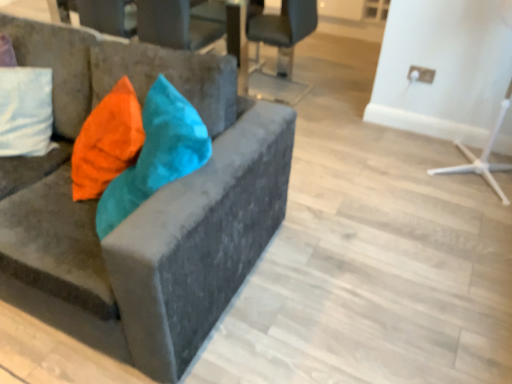
What is the approximate width of matte black chair at upper center, which is the third chair from front to back?

It is 22.44 inches.

The image size is (512, 384). I want to click on metallic gray chair at upper center, which is counted as the 2th chair, starting from the back, so 176,24.

Is point (28, 47) positioned behind point (175, 19)?

That is False.

Considering the sizes of objects velvet cushion at upper left, positioned as the third chair in back-to-front order, and metallic gray chair at upper center, arranged as the second chair when viewed from the front, in the image provided, who is bigger, velvet cushion at upper left, positioned as the third chair in back-to-front order, or metallic gray chair at upper center, arranged as the second chair when viewed from the front,?

Bigger between the two is velvet cushion at upper left, positioned as the third chair in back-to-front order.

Considering the relative positions of velvet cushion at upper left, positioned as the third chair in back-to-front order, and metallic gray chair at upper center, which is counted as the 2th chair, starting from the back, in the image provided, is velvet cushion at upper left, positioned as the third chair in back-to-front order, in front of metallic gray chair at upper center, which is counted as the 2th chair, starting from the back,?

Yes.

From the image's perspective, is velvet cushion at upper left, positioned as the third chair in back-to-front order, positioned above or below metallic gray chair at upper center, arranged as the second chair when viewed from the front?

Based on their image positions, velvet cushion at upper left, positioned as the third chair in back-to-front order, is located beneath metallic gray chair at upper center, arranged as the second chair when viewed from the front.

From the picture: Considering the relative sizes of matte black chair at upper center, which ranks as the first chair in back-to-front order, and velvet orange pillow at left in the image provided, is matte black chair at upper center, which ranks as the first chair in back-to-front order, smaller than velvet orange pillow at left?

No, matte black chair at upper center, which ranks as the first chair in back-to-front order, is not smaller than velvet orange pillow at left.

Which of these two, matte black chair at upper center, which is the third chair from front to back, or velvet orange pillow at left, is wider?

matte black chair at upper center, which is the third chair from front to back.

Is matte black chair at upper center, which is the third chair from front to back, at the right side of velvet orange pillow at left?

Correct, you'll find matte black chair at upper center, which is the third chair from front to back, to the right of velvet orange pillow at left.

From a real-world perspective, who is located lower, matte black chair at upper center, which ranks as the first chair in back-to-front order, or velvet orange pillow at left?

matte black chair at upper center, which ranks as the first chair in back-to-front order.

Is metallic gray chair at upper center, arranged as the second chair when viewed from the front, turned away from matte black chair at upper center, which ranks as the first chair in back-to-front order?

That's not correct — metallic gray chair at upper center, arranged as the second chair when viewed from the front, is not looking away from matte black chair at upper center, which ranks as the first chair in back-to-front order.

Looking at this image, between metallic gray chair at upper center, which is counted as the 2th chair, starting from the back, and matte black chair at upper center, which is the third chair from front to back, which one has smaller width?

Thinner between the two is matte black chair at upper center, which is the third chair from front to back.

Is metallic gray chair at upper center, which is counted as the 2th chair, starting from the back, not close to matte black chair at upper center, which is the third chair from front to back?

Answer: That's not correct — metallic gray chair at upper center, which is counted as the 2th chair, starting from the back, is a little close to matte black chair at upper center, which is the third chair from front to back.

Is metallic gray chair at upper center, which is counted as the 2th chair, starting from the back, taller than matte black chair at upper center, which ranks as the first chair in back-to-front order?

In fact, metallic gray chair at upper center, which is counted as the 2th chair, starting from the back, may be shorter than matte black chair at upper center, which ranks as the first chair in back-to-front order.

Is velvet orange pillow at left looking in the opposite direction of matte black chair at upper center, which ranks as the first chair in back-to-front order?

No, velvet orange pillow at left is not facing away from matte black chair at upper center, which ranks as the first chair in back-to-front order.

Considering the sizes of objects velvet orange pillow at left and matte black chair at upper center, which ranks as the first chair in back-to-front order, in the image provided, who is bigger, velvet orange pillow at left or matte black chair at upper center, which ranks as the first chair in back-to-front order,?

Bigger between the two is matte black chair at upper center, which ranks as the first chair in back-to-front order.

Looking at this image, is velvet orange pillow at left wider than matte black chair at upper center, which is the third chair from front to back?

No.

Relative to velvet orange pillow at left, is velvet cushion at upper left, positioned as the third chair in back-to-front order, in front or behind?

Visually, velvet cushion at upper left, positioned as the third chair in back-to-front order, is located in front of velvet orange pillow at left.

Does velvet cushion at upper left, positioned as the third chair in back-to-front order, appear on the left side of velvet orange pillow at left?

Incorrect, velvet cushion at upper left, positioned as the third chair in back-to-front order, is not on the left side of velvet orange pillow at left.

You are a GUI agent. You are given a task and a screenshot of the screen. Output one action in this format:
    pyautogui.click(x=<x>, y=<y>)
    Task: Click on the studio couch located on the left of velvet cushion at upper left, placed as the 1th chair when sorted from front to back
    
    Given the screenshot: What is the action you would take?
    pyautogui.click(x=57, y=65)

Which object is further away from the camera, velvet orange pillow at left or metallic gray chair at upper center, which is counted as the 2th chair, starting from the back?

metallic gray chair at upper center, which is counted as the 2th chair, starting from the back, is further away from the camera.

Would you say metallic gray chair at upper center, which is counted as the 2th chair, starting from the back, is part of velvet orange pillow at left's contents?

No, velvet orange pillow at left does not contain metallic gray chair at upper center, which is counted as the 2th chair, starting from the back.

In the scene shown: From a real-world perspective, between velvet orange pillow at left and metallic gray chair at upper center, arranged as the second chair when viewed from the front, who is vertically higher?

From a 3D spatial view, velvet orange pillow at left is above.

Can you tell me how much velvet orange pillow at left and metallic gray chair at upper center, which is counted as the 2th chair, starting from the back, differ in facing direction?

138 degrees.

Are metallic gray chair at upper center, which is counted as the 2th chair, starting from the back, and velvet orange pillow at left beside each other?

No, metallic gray chair at upper center, which is counted as the 2th chair, starting from the back, is not touching velvet orange pillow at left.

Is metallic gray chair at upper center, arranged as the second chair when viewed from the front, taller or shorter than velvet orange pillow at left?

metallic gray chair at upper center, arranged as the second chair when viewed from the front, is taller than velvet orange pillow at left.

Does metallic gray chair at upper center, which is counted as the 2th chair, starting from the back, appear on the right side of velvet orange pillow at left?

Yes.

What's the angular difference between metallic gray chair at upper center, which is counted as the 2th chair, starting from the back, and velvet orange pillow at left's facing directions?

138 degrees separate the facing orientations of metallic gray chair at upper center, which is counted as the 2th chair, starting from the back, and velvet orange pillow at left.

Locate an element on the screen. This screenshot has height=384, width=512. chair that is the 2nd object located below the metallic gray chair at upper center, which is counted as the 2th chair, starting from the back (from the image's perspective) is located at coordinates (160, 196).

Locate an element on the screen. chair that is the 2nd object located behind the velvet orange pillow at left is located at coordinates (281, 49).

Estimate the real-world distances between objects in this image. Which object is further from velvet orange pillow at left, velvet cushion at upper left, placed as the 1th chair when sorted from front to back, or metallic gray chair at upper center, arranged as the second chair when viewed from the front?

The object further to velvet orange pillow at left is metallic gray chair at upper center, arranged as the second chair when viewed from the front.

Estimate the real-world distances between objects in this image. Which object is further from metallic gray chair at upper center, which is counted as the 2th chair, starting from the back, matte black chair at upper center, which ranks as the first chair in back-to-front order, or velvet cushion at upper left, placed as the 1th chair when sorted from front to back?

velvet cushion at upper left, placed as the 1th chair when sorted from front to back, is positioned further to the anchor metallic gray chair at upper center, which is counted as the 2th chair, starting from the back.

Consider the image. From the image, which object appears to be nearer to velvet orange pillow at left, metallic gray chair at upper center, arranged as the second chair when viewed from the front, or matte black chair at upper center, which ranks as the first chair in back-to-front order?

Based on the image, metallic gray chair at upper center, arranged as the second chair when viewed from the front, appears to be nearer to velvet orange pillow at left.

Based on their spatial positions, is velvet orange pillow at left or velvet cushion at upper left, positioned as the third chair in back-to-front order, further from matte black chair at upper center, which ranks as the first chair in back-to-front order?

velvet cushion at upper left, positioned as the third chair in back-to-front order, is further to matte black chair at upper center, which ranks as the first chair in back-to-front order.

Considering their positions, is metallic gray chair at upper center, arranged as the second chair when viewed from the front, positioned closer to velvet cushion at upper left, positioned as the third chair in back-to-front order, than matte black chair at upper center, which ranks as the first chair in back-to-front order?

metallic gray chair at upper center, arranged as the second chair when viewed from the front, is closer to velvet cushion at upper left, positioned as the third chair in back-to-front order.

Looking at the image, which one is located closer to velvet cushion at upper left, positioned as the third chair in back-to-front order, metallic gray chair at upper center, which is counted as the 2th chair, starting from the back, or velvet orange pillow at left?

velvet orange pillow at left lies closer to velvet cushion at upper left, positioned as the third chair in back-to-front order, than the other object.

Looking at the image, which one is located further to metallic gray chair at upper center, arranged as the second chair when viewed from the front, velvet cushion at upper left, placed as the 1th chair when sorted from front to back, or matte black chair at upper center, which ranks as the first chair in back-to-front order?

velvet cushion at upper left, placed as the 1th chair when sorted from front to back, is further to metallic gray chair at upper center, arranged as the second chair when viewed from the front.

From the image, which object appears to be nearer to velvet orange pillow at left, matte black chair at upper center, which is the third chair from front to back, or velvet cushion at upper left, positioned as the third chair in back-to-front order?

The object closer to velvet orange pillow at left is velvet cushion at upper left, positioned as the third chair in back-to-front order.

Identify the location of chair between velvet cushion at upper left, placed as the 1th chair when sorted from front to back, and matte black chair at upper center, which is the third chair from front to back, from front to back. This screenshot has width=512, height=384. (176, 24).

Where is `studio couch between velvet cushion at upper left, placed as the 1th chair when sorted from front to back, and matte black chair at upper center, which ranks as the first chair in back-to-front order, along the z-axis`? This screenshot has height=384, width=512. studio couch between velvet cushion at upper left, placed as the 1th chair when sorted from front to back, and matte black chair at upper center, which ranks as the first chair in back-to-front order, along the z-axis is located at coordinates (57, 65).

Locate an element on the screen. The image size is (512, 384). studio couch located between velvet cushion at upper left, placed as the 1th chair when sorted from front to back, and metallic gray chair at upper center, arranged as the second chair when viewed from the front, in the depth direction is located at coordinates (57, 65).